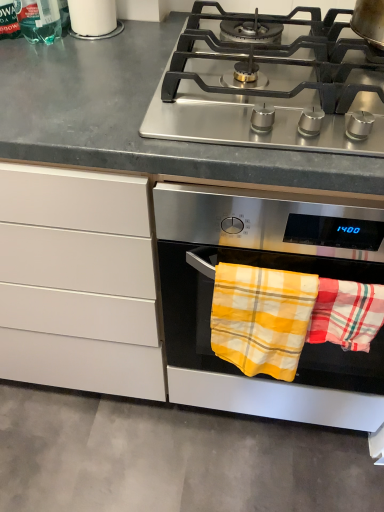
Question: From a real-world perspective, is white glossy cup at upper left located higher than stainless steel gas stove at upper center?

Choices:
 (A) no
 (B) yes

Answer: (B)

Question: Is white glossy cup at upper left at the right side of stainless steel gas stove at upper center?

Choices:
 (A) no
 (B) yes

Answer: (A)

Question: Considering the relative sizes of white glossy cup at upper left and stainless steel gas stove at upper center in the image provided, is white glossy cup at upper left thinner than stainless steel gas stove at upper center?

Choices:
 (A) no
 (B) yes

Answer: (B)

Question: Considering the relative sizes of white glossy cup at upper left and stainless steel gas stove at upper center in the image provided, is white glossy cup at upper left taller than stainless steel gas stove at upper center?

Choices:
 (A) yes
 (B) no

Answer: (A)

Question: Does white glossy cup at upper left lie in front of stainless steel gas stove at upper center?

Choices:
 (A) yes
 (B) no

Answer: (B)

Question: Is stainless steel pot at upper right inside the boundaries of stainless steel oven at center, or outside?

Choices:
 (A) outside
 (B) inside

Answer: (A)

Question: Considering the positions of stainless steel pot at upper right and stainless steel oven at center in the image, is stainless steel pot at upper right taller or shorter than stainless steel oven at center?

Choices:
 (A) short
 (B) tall

Answer: (A)

Question: Is stainless steel pot at upper right bigger or smaller than stainless steel oven at center?

Choices:
 (A) small
 (B) big

Answer: (A)

Question: From the image's perspective, is stainless steel pot at upper right above or below stainless steel oven at center?

Choices:
 (A) below
 (B) above

Answer: (B)

Question: Is point (380, 49) closer or farther from the camera than point (281, 125)?

Choices:
 (A) farther
 (B) closer

Answer: (A)

Question: Considering the positions of stainless steel pot at upper right and stainless steel gas stove at upper center in the image, is stainless steel pot at upper right taller or shorter than stainless steel gas stove at upper center?

Choices:
 (A) tall
 (B) short

Answer: (A)

Question: Considering the positions of stainless steel pot at upper right and stainless steel gas stove at upper center in the image, is stainless steel pot at upper right wider or thinner than stainless steel gas stove at upper center?

Choices:
 (A) thin
 (B) wide

Answer: (A)

Question: In the image, is stainless steel pot at upper right on the left side or the right side of stainless steel gas stove at upper center?

Choices:
 (A) left
 (B) right

Answer: (B)

Question: In the image, is white glossy cup at upper left on the left side or the right side of stainless steel oven at center?

Choices:
 (A) right
 (B) left

Answer: (B)

Question: Considering the positions of point (107, 7) and point (157, 229), is point (107, 7) closer or farther from the camera than point (157, 229)?

Choices:
 (A) closer
 (B) farther

Answer: (B)